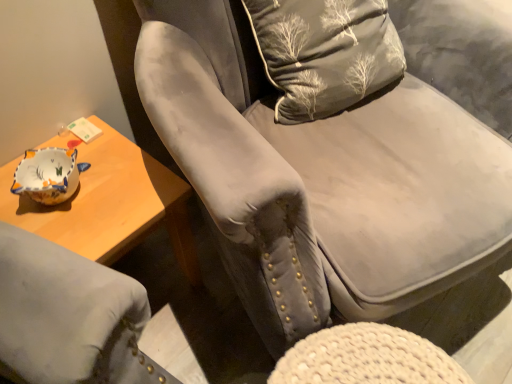
Describe the element at coordinates (321, 159) in the screenshot. I see `velvet gray chair at center` at that location.

What is the approximate height of velvet gray chair at center?

velvet gray chair at center is 35.39 inches in height.

In order to face velvet gray chair at center, should I rotate leftwards or rightwards?

Turn right approximately 11.840 degrees to face it.

You are a GUI agent. You are given a task and a screenshot of the screen. Output one action in this format:
    pyautogui.click(x=<x>, y=<y>)
    Task: Click on the velvet gray chair at center
    This screenshot has height=384, width=512.
    Given the screenshot: What is the action you would take?
    pyautogui.click(x=321, y=159)

The width and height of the screenshot is (512, 384). What are the coordinates of `velvet gray chair at center` in the screenshot? It's located at (321, 159).